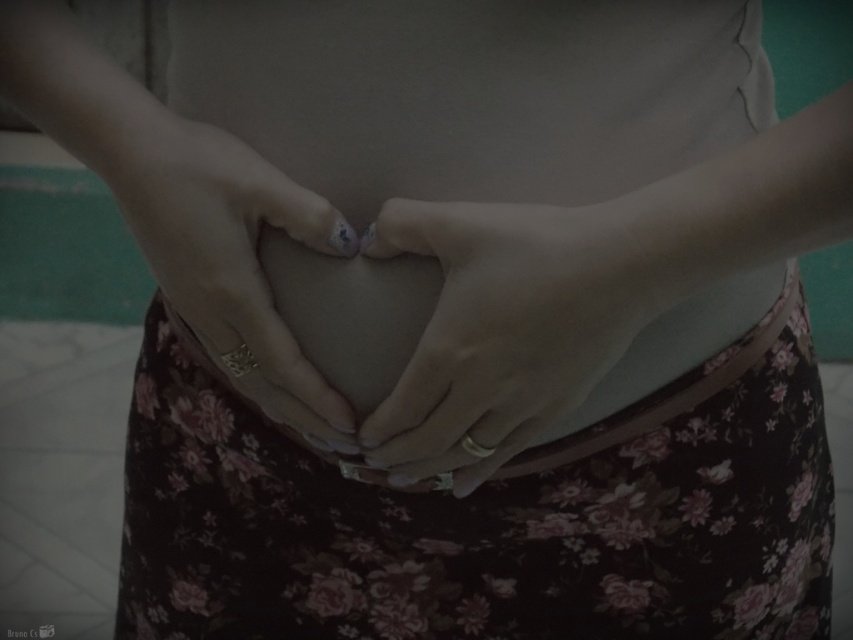
Question: Is floral fabric dress at center wider than matte gold ring at center?

Choices:
 (A) yes
 (B) no

Answer: (A)

Question: Observing the image, what is the correct spatial positioning of floral fabric dress at center in reference to matte gold ring at center?

Choices:
 (A) right
 (B) left

Answer: (A)

Question: Which object is the closest to the floral fabric dress at center?

Choices:
 (A) matte gold ring at center
 (B) smooth skin hand at center

Answer: (B)

Question: Considering the real-world distances, which object is farthest from the floral fabric dress at center?

Choices:
 (A) matte gold ring at center
 (B) smooth skin hand at center

Answer: (A)

Question: Can you confirm if floral fabric dress at center is positioned to the left of matte gold ring at center?

Choices:
 (A) yes
 (B) no

Answer: (B)

Question: Based on their relative distances, which object is nearer to the floral fabric dress at center?

Choices:
 (A) smooth skin hand at center
 (B) matte gold ring at center

Answer: (A)